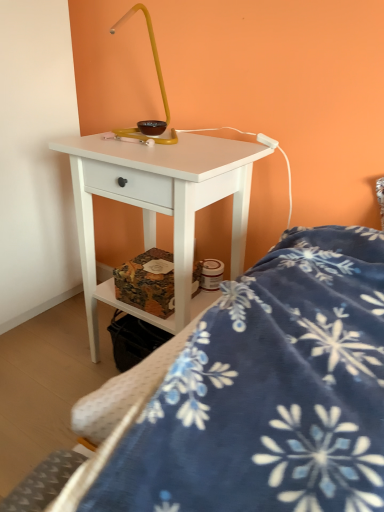
Question: Considering the relative sizes of blue fleece blanket at lower right and white matte nightstand at center in the image provided, is blue fleece blanket at lower right bigger than white matte nightstand at center?

Choices:
 (A) yes
 (B) no

Answer: (B)

Question: Is blue fleece blanket at lower right next to white matte nightstand at center?

Choices:
 (A) no
 (B) yes

Answer: (A)

Question: Is blue fleece blanket at lower right positioned before white matte nightstand at center?

Choices:
 (A) no
 (B) yes

Answer: (B)

Question: Does blue fleece blanket at lower right appear on the left side of white matte nightstand at center?

Choices:
 (A) yes
 (B) no

Answer: (B)

Question: Does blue fleece blanket at lower right have a greater width compared to white matte nightstand at center?

Choices:
 (A) yes
 (B) no

Answer: (A)

Question: Does blue fleece blanket at lower right turn towards white matte nightstand at center?

Choices:
 (A) yes
 (B) no

Answer: (B)

Question: Does white matte nightstand at center have a larger size compared to blue fleece blanket at lower right?

Choices:
 (A) yes
 (B) no

Answer: (A)

Question: Is there a large distance between white matte nightstand at center and blue fleece blanket at lower right?

Choices:
 (A) yes
 (B) no

Answer: (B)

Question: Is white matte nightstand at center closer to the viewer compared to blue fleece blanket at lower right?

Choices:
 (A) no
 (B) yes

Answer: (A)

Question: From a real-world perspective, is white matte nightstand at center below blue fleece blanket at lower right?

Choices:
 (A) yes
 (B) no

Answer: (A)

Question: Would you say white matte nightstand at center is outside blue fleece blanket at lower right?

Choices:
 (A) yes
 (B) no

Answer: (A)

Question: Is white matte nightstand at center aimed at blue fleece blanket at lower right?

Choices:
 (A) no
 (B) yes

Answer: (A)

Question: Does point (365, 484) appear closer or farther from the camera than point (193, 237)?

Choices:
 (A) closer
 (B) farther

Answer: (A)